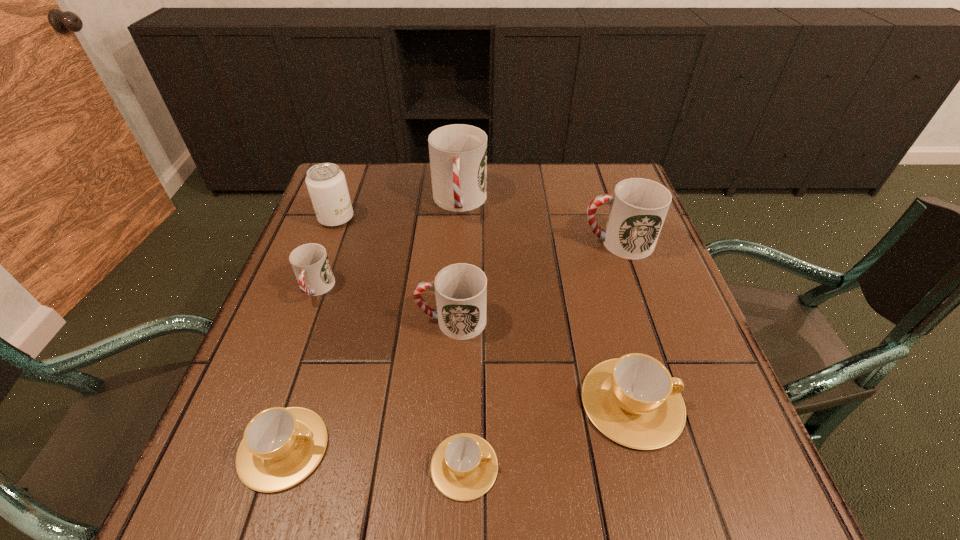
This screenshot has height=540, width=960. I want to click on the leftmost brown cup, so click(x=281, y=446).

At what (x,y) coordinates should I click in order to perform the action: click on the shortest object. Please return your answer as a coordinate pair (x, y). Looking at the image, I should click on (464, 466).

Find the location of a particular element. This screenshot has height=540, width=960. the second brown cup from right to left is located at coordinates (464, 466).

You are a GUI agent. You are given a task and a screenshot of the screen. Output one action in this format:
    pyautogui.click(x=<x>, y=<y>)
    Task: Click on the free space located on the side of the tallest cup where the handle is located
    
    Given the screenshot: What is the action you would take?
    pyautogui.click(x=455, y=292)

At what (x,y) coordinates should I click in order to perform the action: click on vacant area located 0.210m on the side of the rightmost red cup where the handle is located. Please return your answer as a coordinate pair (x, y). The width and height of the screenshot is (960, 540). Looking at the image, I should click on (496, 242).

Identify the location of vacant space located 0.370m on the side of the rightmost red cup where the handle is located. (432, 242).

The height and width of the screenshot is (540, 960). I want to click on vacant space situated on the side of the rightmost red cup where the handle is located, so [544, 242].

At what (x,y) coordinates should I click in order to perform the action: click on free space located on the back of the soda can. Please return your answer as a coordinate pair (x, y). This screenshot has width=960, height=540. Looking at the image, I should click on (x=351, y=180).

This screenshot has height=540, width=960. Identify the location of blank area located 0.220m on the side of the fourth tallest object where the handle is located. (312, 321).

You are a GUI agent. You are given a task and a screenshot of the screen. Output one action in this format:
    pyautogui.click(x=<x>, y=<y>)
    Task: Click on the vacant space located 0.200m on the side of the fourth tallest object where the handle is located
    
    Given the screenshot: What is the action you would take?
    tap(322, 321)